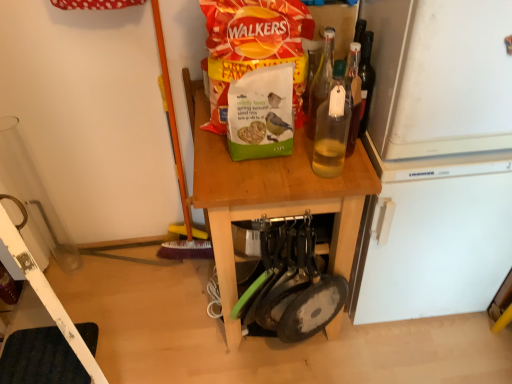
Locate an element on the screen. free region on the left part of wooden table at center is located at coordinates (158, 307).